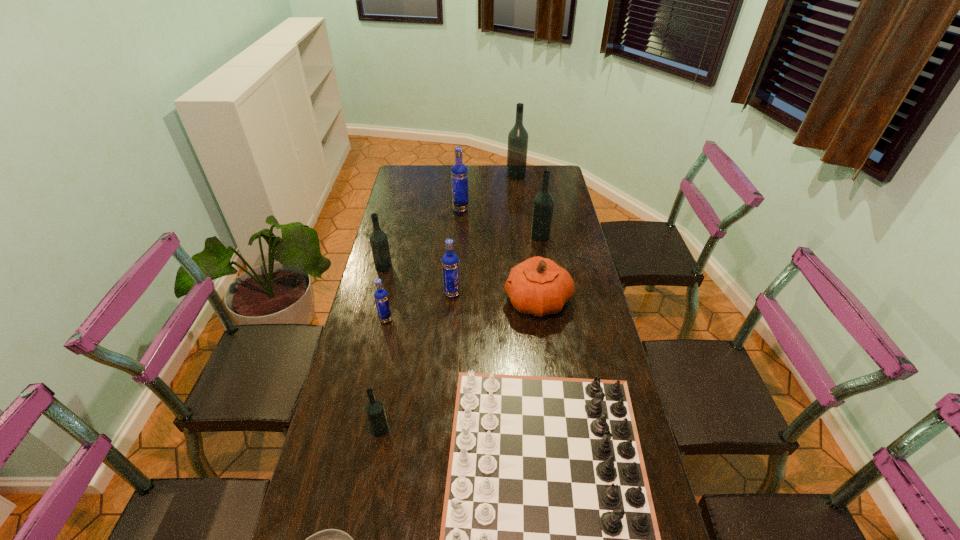
Identify the location of orange pumpkin. (538, 286).

You are a GUI agent. You are given a task and a screenshot of the screen. Output one action in this format:
    pyautogui.click(x=<x>, y=<y>)
    Task: Click on the leftmost blue vodka
    The width and height of the screenshot is (960, 540).
    Given the screenshot: What is the action you would take?
    pyautogui.click(x=381, y=296)

You are a GUI agent. You are given a task and a screenshot of the screen. Output one action in this format:
    pyautogui.click(x=<x>, y=<y>)
    Task: Click on the sixth farthest vodka
    
    Given the screenshot: What is the action you would take?
    pyautogui.click(x=381, y=296)

Find the location of a particular element. This screenshot has width=960, height=540. the third black vodka from right to left is located at coordinates (374, 409).

Image resolution: width=960 pixels, height=540 pixels. I want to click on the nearest black vodka, so click(x=374, y=409).

At what (x,y) coordinates should I click in order to perform the action: click on free location located 0.050m on the back of the farthest vodka. Please return your answer as a coordinate pair (x, y). The width and height of the screenshot is (960, 540). Looking at the image, I should click on (515, 166).

Identify the location of free space located 0.100m on the front of the second farthest vodka. (460, 227).

The image size is (960, 540). Identify the location of vacant space located on the back of the third farthest vodka. [536, 211].

The height and width of the screenshot is (540, 960). In order to click on free space located 0.260m on the front of the second nearest black vodka in this screenshot , I will do coord(370,322).

At what (x,y) coordinates should I click in order to perform the action: click on free space located on the back of the fifth farthest vodka. Please return your answer as a coordinate pair (x, y). Looking at the image, I should click on (456, 240).